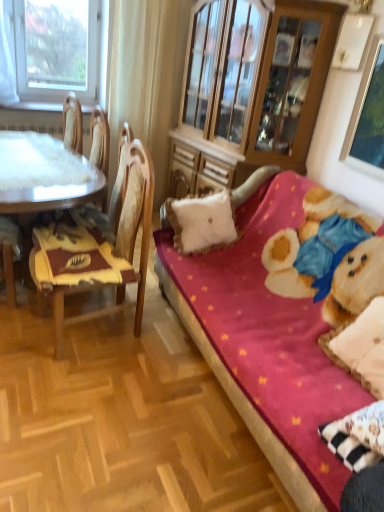
This screenshot has width=384, height=512. What do you see at coordinates (98, 247) in the screenshot?
I see `wooden chair at left` at bounding box center [98, 247].

Measure the distance between point [130,203] and camera.

A distance of 7.05 feet exists between point [130,203] and camera.

This screenshot has width=384, height=512. I want to click on transparent glass window at upper left, so click(58, 48).

Identify the location of white soft cushion at center. The height and width of the screenshot is (512, 384). (201, 222).

What do you see at coordinates (201, 222) in the screenshot? The image size is (384, 512). I see `white soft cushion at center` at bounding box center [201, 222].

At what (x,y) coordinates should I click in order to perform the action: click on white fabric curtain at upper left. Please return your answer as a coordinate pair (x, y). The height and width of the screenshot is (512, 384). Looking at the image, I should click on (146, 77).

This screenshot has width=384, height=512. What do you see at coordinates (146, 77) in the screenshot?
I see `white fabric curtain at upper left` at bounding box center [146, 77].

You are a GUI agent. You are given a task and a screenshot of the screen. Output one action in this format:
    pyautogui.click(x=<x>, y=<y>)
    Task: Click on the wooden chair at left
    
    Given the screenshot: What is the action you would take?
    pyautogui.click(x=98, y=247)

Does white soft cushion at center turn towards velvet pink couch at right?

Yes, white soft cushion at center is oriented towards velvet pink couch at right.

Considering the sizes of objects white soft cushion at center and velvet pink couch at right in the image provided, who is smaller, white soft cushion at center or velvet pink couch at right?

With smaller size is white soft cushion at center.

Is white soft cushion at center taller or shorter than velvet pink couch at right?

In the image, white soft cushion at center appears to be shorter than velvet pink couch at right.

Can you confirm if wooden chair at left is taller than wooden cabinet at center?

No.

From a real-world perspective, is wooden chair at left beneath wooden cabinet at center?

Yes.

Is wooden chair at left facing towards wooden cabinet at center?

No.

Is there a large distance between wooden chair at left and wooden cabinet at center?

Yes, wooden chair at left and wooden cabinet at center are located far from each other.

From a real-world perspective, between velvet pink couch at right and wooden chair at left, who is vertically higher?

wooden chair at left, from a real-world perspective.

Where is `chair on the left of velvet pink couch at right`? This screenshot has width=384, height=512. chair on the left of velvet pink couch at right is located at coordinates (98, 247).

Looking at this image, from the image's perspective, would you say velvet pink couch at right is positioned over wooden chair at left?

No.

Considering the positions of objects velvet pink couch at right and wooden chair at left in the image provided, who is more to the left, velvet pink couch at right or wooden chair at left?

From the viewer's perspective, wooden chair at left appears more on the left side.

From the image's perspective, which one is positioned lower, white fabric curtain at upper left or white glossy table at left?

white glossy table at left.

Does white fabric curtain at upper left turn towards white glossy table at left?

No, white fabric curtain at upper left is not aimed at white glossy table at left.

Which is further, [244,124] or [129,237]?

The point [244,124] is more distant.

Are wooden cabinet at center and wooden chair at left making contact?

No.

Does wooden cabinet at center have a lesser width compared to wooden chair at left?

In fact, wooden cabinet at center might be wider than wooden chair at left.

Does white fabric curtain at upper left have a greater width compared to white soft cushion at center?

No, white fabric curtain at upper left is not wider than white soft cushion at center.

From a real-world perspective, is white fabric curtain at upper left beneath white soft cushion at center?

Actually, white fabric curtain at upper left is physically above white soft cushion at center in the real world.

How much distance is there between white fabric curtain at upper left and white soft cushion at center?

white fabric curtain at upper left is 1.57 meters from white soft cushion at center.

Is white fabric curtain at upper left taller than white soft cushion at center?

Indeed, white fabric curtain at upper left has a greater height compared to white soft cushion at center.

In terms of width, does transparent glass window at upper left look wider or thinner when compared to metallic silver picture frame at upper right?

Clearly, transparent glass window at upper left has more width compared to metallic silver picture frame at upper right.

From the image's perspective, which object appears higher, transparent glass window at upper left or metallic silver picture frame at upper right?

From the image's view, transparent glass window at upper left is above.

Which is nearer, (64, 93) or (352, 152)?

Point (64, 93) is farther from the camera than point (352, 152).

Considering the relative sizes of transparent glass window at upper left and metallic silver picture frame at upper right in the image provided, is transparent glass window at upper left shorter than metallic silver picture frame at upper right?

Incorrect, the height of transparent glass window at upper left does not fall short of that of metallic silver picture frame at upper right.

You are a GUI agent. You are given a task and a screenshot of the screen. Output one action in this format:
    pyautogui.click(x=<x>, y=<y>)
    Task: Click on the studio couch on the right side of white soft cushion at center
    
    Given the screenshot: What is the action you would take?
    pyautogui.click(x=242, y=401)

In the image, there is a wooden cabinet at center. Identify the location of chair below it (from a real-world perspective). This screenshot has height=512, width=384. (98, 247).

Looking at the image, which one is located closer to velvet pink couch at right, wooden cabinet at center or metallic silver picture frame at upper right?

Among the two, wooden cabinet at center is located nearer to velvet pink couch at right.

Which object lies further to the anchor point velvet pink couch at right, metallic silver picture frame at upper right or white glossy table at left?

Among the two, metallic silver picture frame at upper right is located further to velvet pink couch at right.

When comparing their distances from wooden cabinet at center, does white soft cushion at center or velvet pink couch at right seem further?

velvet pink couch at right is positioned further to the anchor wooden cabinet at center.

Looking at the image, which one is located closer to white soft cushion at center, white glossy table at left or velvet pink couch at right?

velvet pink couch at right.

Based on their spatial positions, is wooden chair at left or velvet pink couch at right closer to wooden cabinet at center?

velvet pink couch at right is positioned closer to the anchor wooden cabinet at center.

Which object lies nearer to the anchor point wooden chair at left, transparent glass window at upper left or white glossy table at left?

white glossy table at left is positioned closer to the anchor wooden chair at left.

Estimate the real-world distances between objects in this image. Which object is closer to velvet pink couch at right, metallic silver picture frame at upper right or wooden chair at left?

wooden chair at left is positioned closer to the anchor velvet pink couch at right.

Looking at the image, which one is located closer to white soft cushion at center, wooden chair at left or white glossy table at left?

Based on the image, wooden chair at left appears to be nearer to white soft cushion at center.

This screenshot has height=512, width=384. I want to click on curtain located between transparent glass window at upper left and wooden cabinet at center in the left-right direction, so [x=146, y=77].

I want to click on chair located between velvet pink couch at right and white soft cushion at center in the depth direction, so click(x=98, y=247).

This screenshot has height=512, width=384. In order to click on picture frame located between velvet pink couch at right and white soft cushion at center in the depth direction in this screenshot , I will do `click(368, 117)`.

Find the location of `curtain between white glossy table at left and wooden cabinet at center in the horizontal direction`. curtain between white glossy table at left and wooden cabinet at center in the horizontal direction is located at coordinates (146, 77).